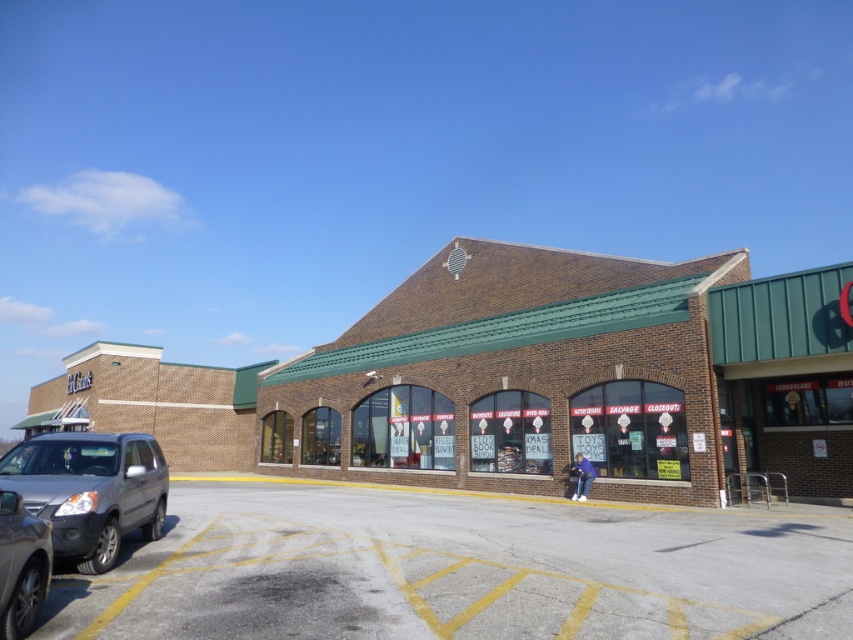
You are standing in front of the commercial building and want to find the gray asphalt parking lot at lower left. According to the scene description, where should you look to locate it?

The gray asphalt parking lot at lower left is located at point (460, 570), so you should look towards the lower left area of the scene to find it there.

You are a delivery driver arriving at the commercial building. You need to park your truck, which is 2 meters wide, between the matte gray suv at lower left and the satin silver sedan at lower left. Is there enough space for your truck?

The satin silver sedan at lower left is behind the matte gray suv at lower left, so there is space between them. However, the exact width isn

You are a delivery person needing to park your truck, which is 10 feet wide, in the parking area. The gray asphalt parking lot at lower left has marked spaces. Can your truck fit into the space where the matte gray suv at lower left is currently parked?

The gray asphalt parking lot at lower left has a larger size compared to matte gray suv at lower left. Since the parking space is larger than the SUV, the truck which is 10 feet wide can likely fit as long as the space dimensions accommodate its size.